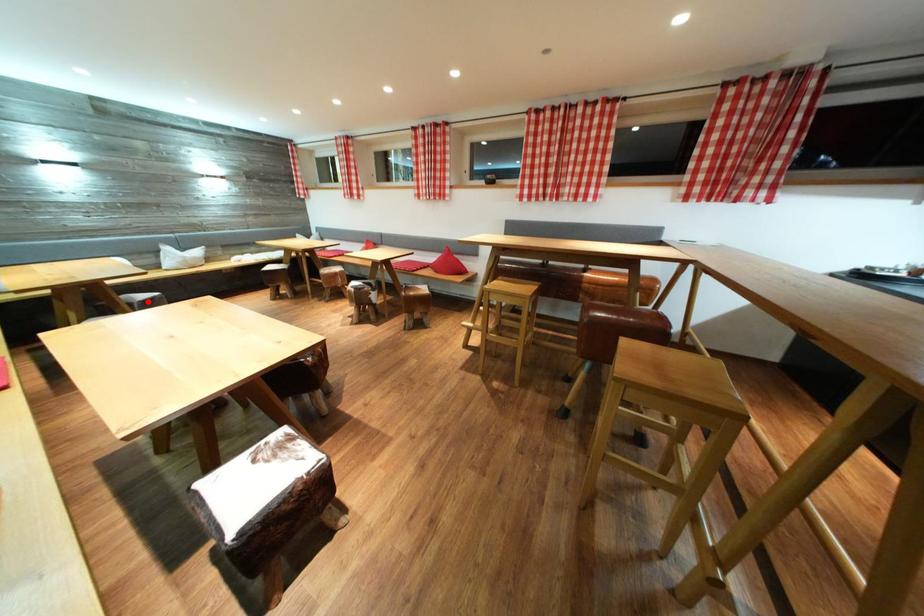
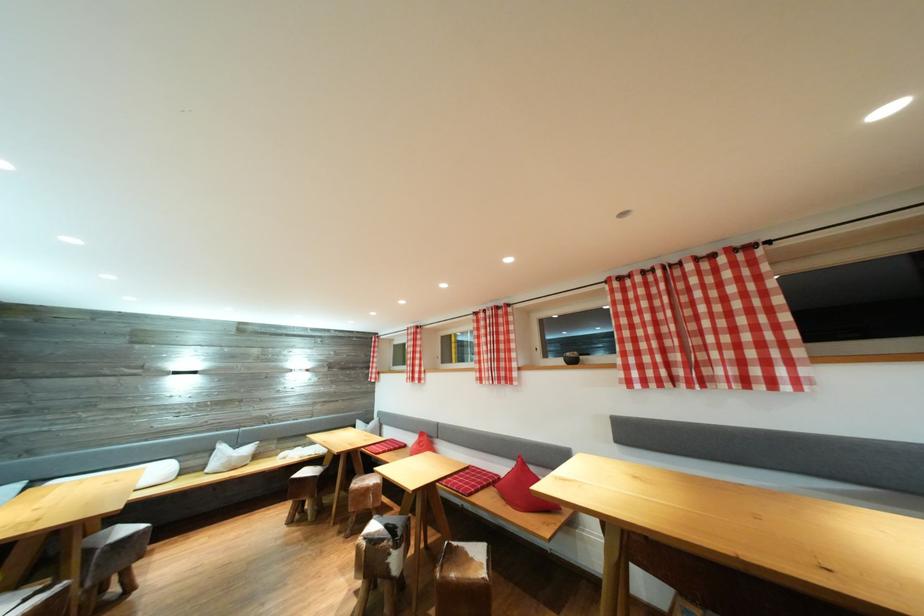
The point at the highlighted location is marked in the first image. Where is the corresponding point in the second image?

(131, 536)